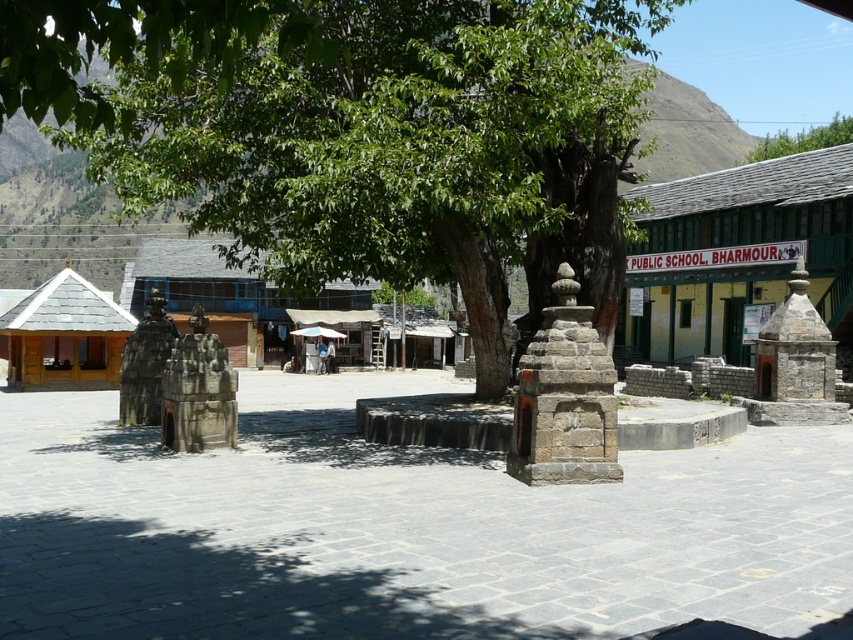
Is green leafy tree at center closer to camera compared to gray stone stupa at center?

Yes, green leafy tree at center is closer to the viewer.

Does point (537, 10) come closer to viewer compared to point (561, 442)?

No, (537, 10) is behind (561, 442).

Is point (462, 202) farther from camera compared to point (604, 394)?

Yes, point (462, 202) is behind point (604, 394).

Where is `green leafy tree at center`? The image size is (853, 640). green leafy tree at center is located at coordinates (403, 147).

Between green leafy tree at center and green leafy tree at upper right, which one appears on the right side from the viewer's perspective?

green leafy tree at upper right

Does point (285, 193) come behind point (785, 140)?

No.

Who is more distant from viewer, (x=378, y=19) or (x=798, y=147)?

Positioned behind is point (x=798, y=147).

The width and height of the screenshot is (853, 640). I want to click on green leafy tree at center, so click(403, 147).

Between gray stone stupa at center and green leafy tree at upper right, which one has more height?

Standing taller between the two is green leafy tree at upper right.

The image size is (853, 640). What do you see at coordinates (564, 397) in the screenshot?
I see `gray stone stupa at center` at bounding box center [564, 397].

Between point (520, 468) and point (833, 129), which one is positioned in front?

Point (520, 468)

Where is `gray stone stupa at center`? gray stone stupa at center is located at coordinates (564, 397).